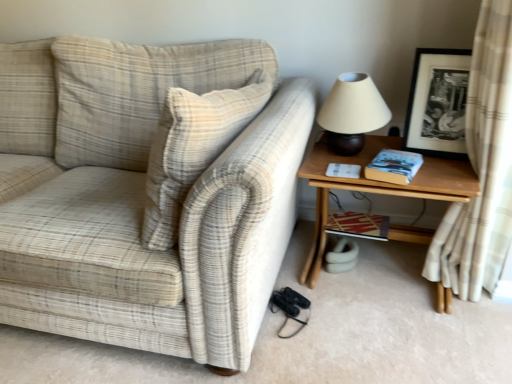
Find the location of a particular element. The height and width of the screenshot is (384, 512). vacant space in matte beige lampshade at upper right (from a real-world perspective) is located at coordinates coord(352,153).